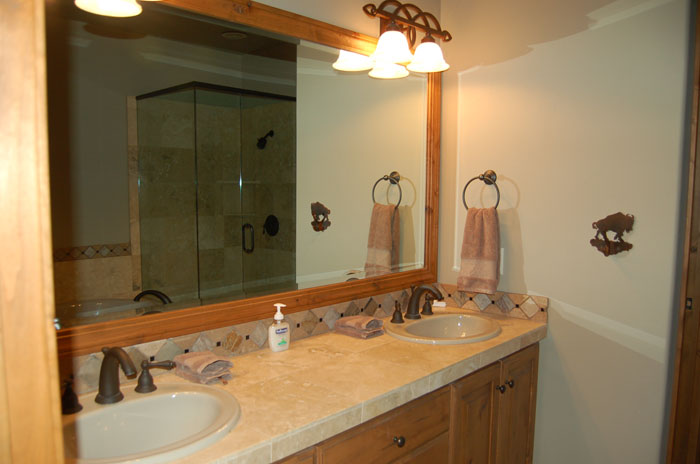
You are a GUI agent. You are given a task and a screenshot of the screen. Output one action in this format:
    pyautogui.click(x=<x>, y=<y>)
    Task: Click on the hand soap
    
    Given the screenshot: What is the action you would take?
    point(279,330)